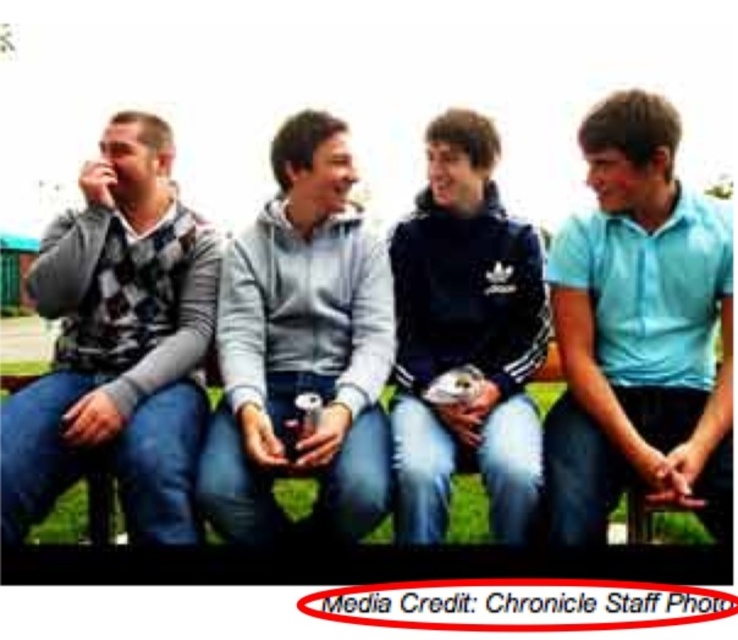
You are standing 1 meter away from the matte gray sweater at left. Can you reach the gray fleece hoodie at center without moving your feet?

The distance between the matte gray sweater at left and the gray fleece hoodie at center is 66.68 centimeters. Since you are 1 meter away from the matte gray sweater at left, you would be 1 meter plus 66.68 centimeters away from the gray fleece hoodie at center. Therefore, you cannot reach the gray fleece hoodie at center without moving your feet.